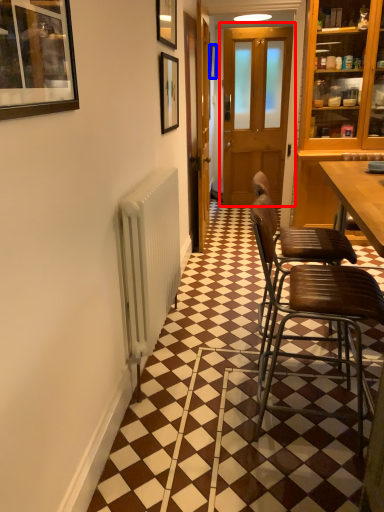
Question: Among these objects, which one is farthest to the camera, door (highlighted by a red box) or picture frame (highlighted by a blue box)?

Choices:
 (A) door
 (B) picture frame

Answer: (B)